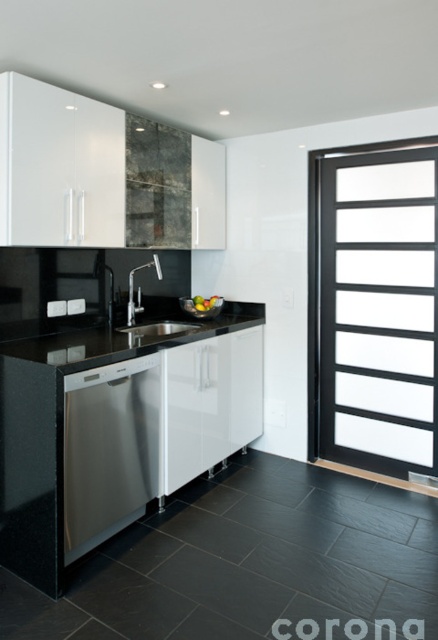
Which is more to the left, transparent matte glass door at right or satin stainless steel sink at center?

satin stainless steel sink at center

Is point (378, 397) positioned before point (159, 336)?

That is False.

Which is behind, point (368, 403) or point (187, 328)?

Positioned behind is point (187, 328).

I want to click on transparent matte glass door at right, so click(374, 307).

Can you confirm if stainless steel dishwasher at lower left is positioned above satin stainless steel sink at center?

No.

Can you confirm if stainless steel dishwasher at lower left is thinner than satin stainless steel sink at center?

Yes.

Image resolution: width=438 pixels, height=640 pixels. What do you see at coordinates (109, 451) in the screenshot? I see `stainless steel dishwasher at lower left` at bounding box center [109, 451].

Find the location of a particular element. Image resolution: width=438 pixels, height=640 pixels. stainless steel dishwasher at lower left is located at coordinates (109, 451).

Is black granite countertop at center bigger than black stainless steel sink at center?

Yes, black granite countertop at center is bigger than black stainless steel sink at center.

Is black granite countertop at center smaller than black stainless steel sink at center?

No, black granite countertop at center is not smaller than black stainless steel sink at center.

Does point (221, 317) come farther from viewer compared to point (137, 310)?

Yes.

Image resolution: width=438 pixels, height=640 pixels. Find the location of `black granite countertop at center`. black granite countertop at center is located at coordinates (127, 339).